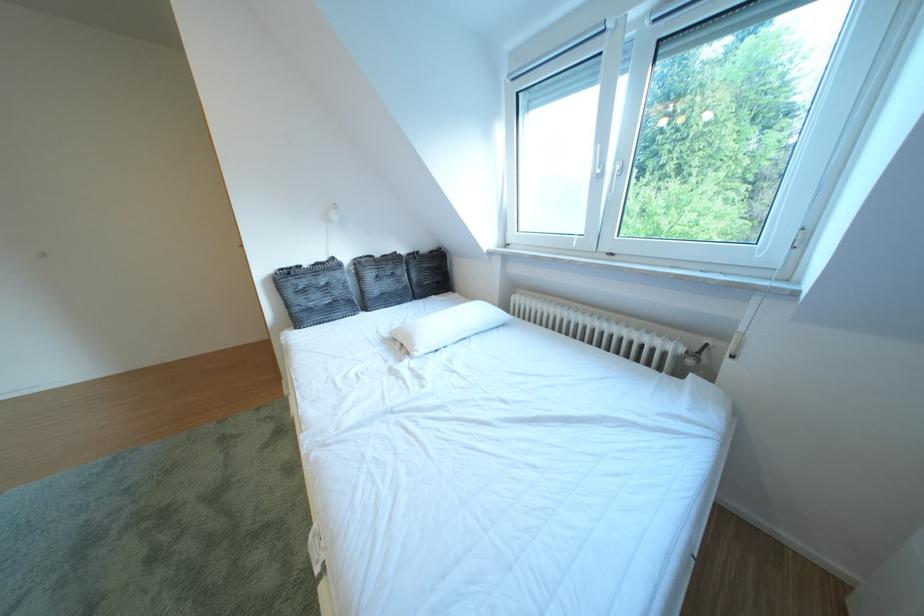
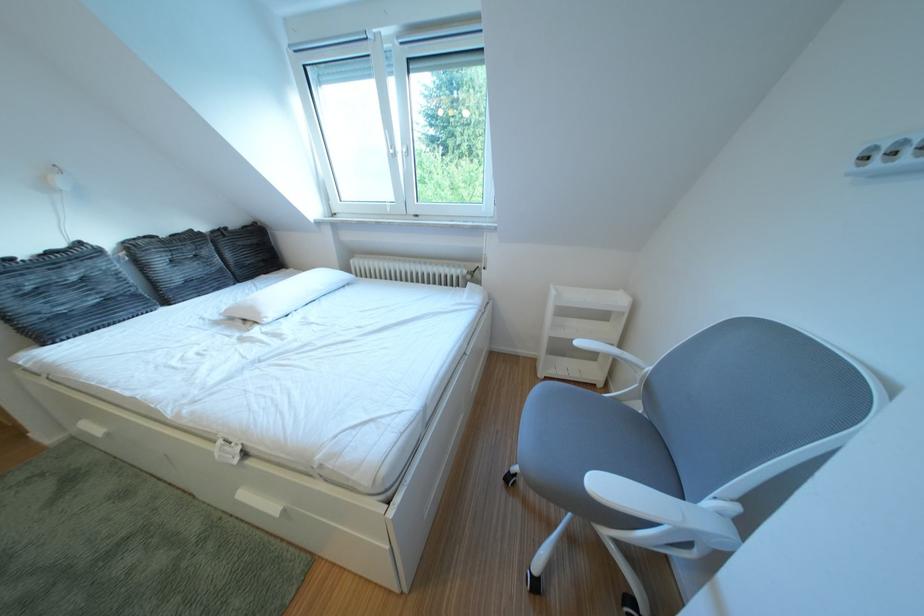
Locate, in the second image, the point that corresponds to pixel 439 253 in the first image.

(247, 228)